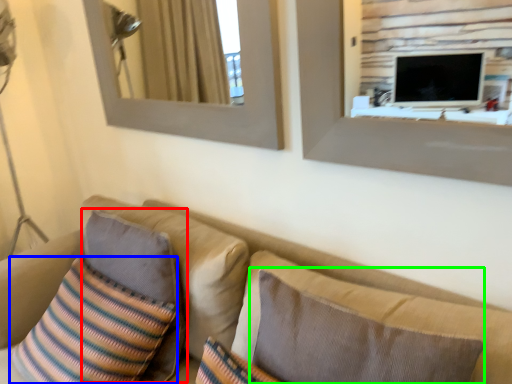
Question: Estimate the real-world distances between objects in this image. Which object is closer to pillow (highlighted by a red box), throw pillow (highlighted by a blue box) or pillow (highlighted by a green box)?

Choices:
 (A) throw pillow
 (B) pillow

Answer: (A)